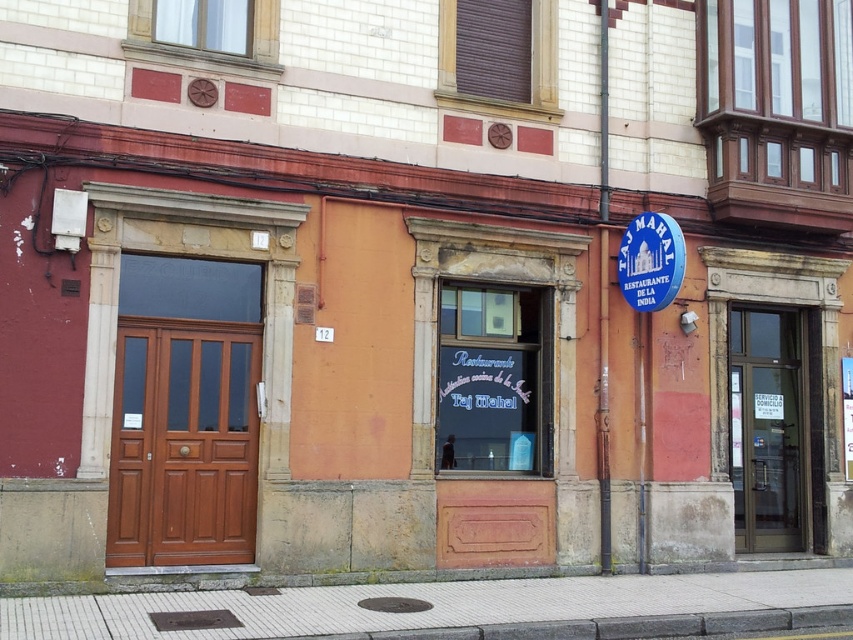
Is matte brown door at right smaller than blue plastic sign at upper center?

Incorrect, matte brown door at right is not smaller in size than blue plastic sign at upper center.

Can you confirm if matte brown door at right is positioned to the right of blue plastic sign at upper center?

Correct, you'll find matte brown door at right to the right of blue plastic sign at upper center.

Which is behind, point (787, 461) or point (646, 269)?

Point (787, 461)

Locate an element on the screen. matte brown door at right is located at coordinates (764, 429).

At what (x,y) coordinates should I click in order to perform the action: click on matte brown door at right. Please return your answer as a coordinate pair (x, y). The height and width of the screenshot is (640, 853). Looking at the image, I should click on (764, 429).

Which is above, matte brown door at right or blue plastic sign at upper right?

blue plastic sign at upper right is higher up.

Based on the photo, measure the distance between matte brown door at right and camera.

matte brown door at right is 12.14 meters away from camera.

Where is `matte brown door at right`? The height and width of the screenshot is (640, 853). matte brown door at right is located at coordinates (764, 429).

Is brown wooden door at center positioned behind blue plastic sign at upper right?

That is False.

Measure the distance between brown wooden door at center and camera.

A distance of 9.45 meters exists between brown wooden door at center and camera.

This screenshot has width=853, height=640. Identify the location of brown wooden door at center. (183, 442).